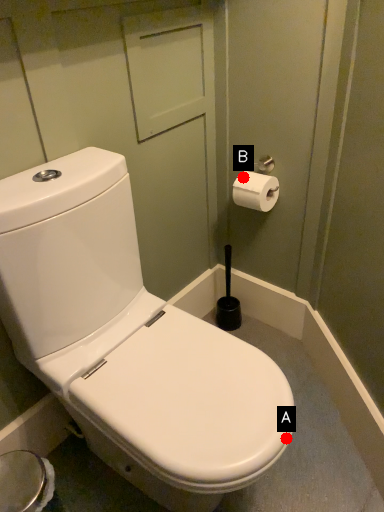
Question: Two points are circled on the image, labeled by A and B beside each circle. Which of the following is the closest to the observer?

Choices:
 (A) A is closer
 (B) B is closer

Answer: (A)